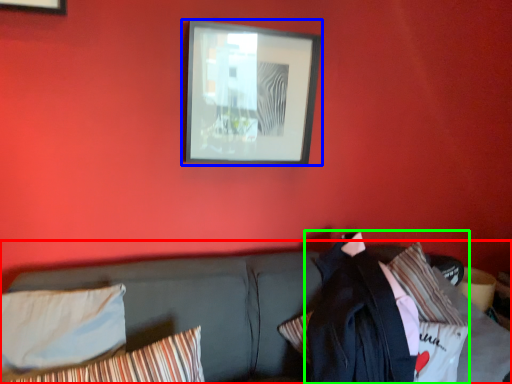
Question: Based on their relative distances, which object is farther from studio couch (highlighted by a red box)? Choose from picture frame (highlighted by a blue box) and jacket (highlighted by a green box).

Choices:
 (A) picture frame
 (B) jacket

Answer: (A)